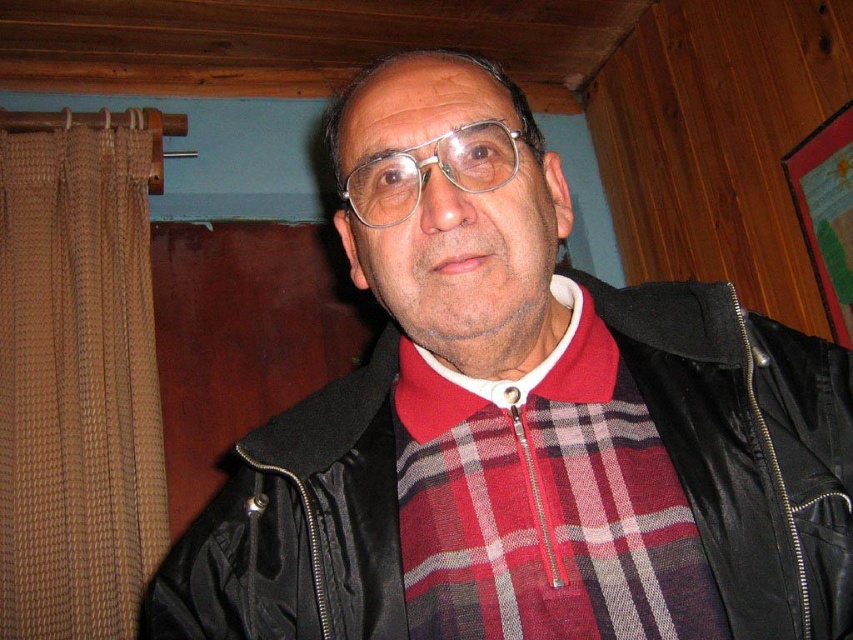
Question: Considering the relative positions of plaid fabric at center and clear plastic glasses at center in the image provided, where is plaid fabric at center located with respect to clear plastic glasses at center?

Choices:
 (A) below
 (B) above

Answer: (A)

Question: Among these objects, which one is nearest to the camera?

Choices:
 (A) plaid fabric at center
 (B) clear plastic glasses at center

Answer: (B)

Question: Can you confirm if plaid fabric at center is bigger than clear plastic glasses at center?

Choices:
 (A) yes
 (B) no

Answer: (A)

Question: Where is plaid fabric at center located in relation to clear plastic glasses at center in the image?

Choices:
 (A) right
 (B) left

Answer: (A)

Question: Which point appears closest to the camera in this image?

Choices:
 (A) (372, 188)
 (B) (677, 563)

Answer: (A)